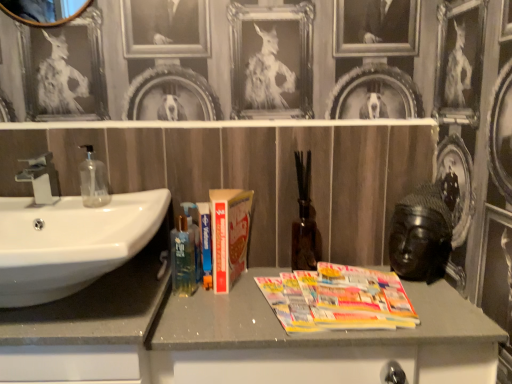
You are a GUI agent. You are given a task and a screenshot of the screen. Output one action in this format:
    pyautogui.click(x=<x>, y=<y>)
    Task: Click on the vacant space behind matte silver faucet at left
    This screenshot has width=512, height=384.
    Given the screenshot: What is the action you would take?
    pyautogui.click(x=55, y=198)